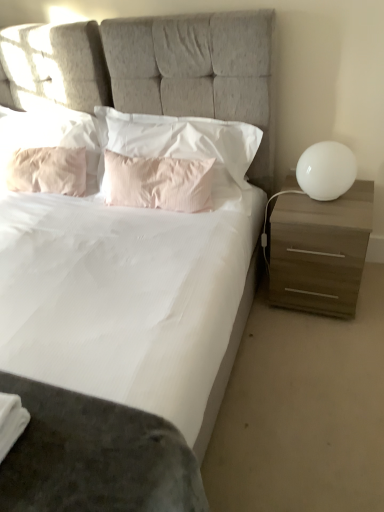
Question: In terms of height, does pink satin pillow at center, marked as the 2th pillow in a right-to-left arrangement, look taller or shorter compared to white glossy sphere at right?

Choices:
 (A) tall
 (B) short

Answer: (A)

Question: In the image, is pink satin pillow at center, the 3th pillow in the left-to-right sequence, on the left side or the right side of white glossy sphere at right?

Choices:
 (A) right
 (B) left

Answer: (B)

Question: Which object is positioned farthest from the pink cotton pillow at center, arranged as the 1th pillow when viewed from the right?

Choices:
 (A) white fabric bed at center
 (B) light brown wood nightstand at right
 (C) pink fabric pillow at upper left, the 1th pillow in the left-to-right sequence
 (D) pink satin pillow at center, the 3th pillow in the left-to-right sequence
 (E) pink fabric pillow at upper left, arranged as the third pillow when viewed from the right

Answer: (B)

Question: Which object is the farthest from the pink satin pillow at center, the 3th pillow in the left-to-right sequence?

Choices:
 (A) pink cotton pillow at center, which appears as the fourth pillow when viewed from the left
 (B) light brown wood nightstand at right
 (C) pink fabric pillow at upper left, arranged as the third pillow when viewed from the right
 (D) pink fabric pillow at upper left, arranged as the 4th pillow when viewed from the right
 (E) white fabric bed at center

Answer: (B)